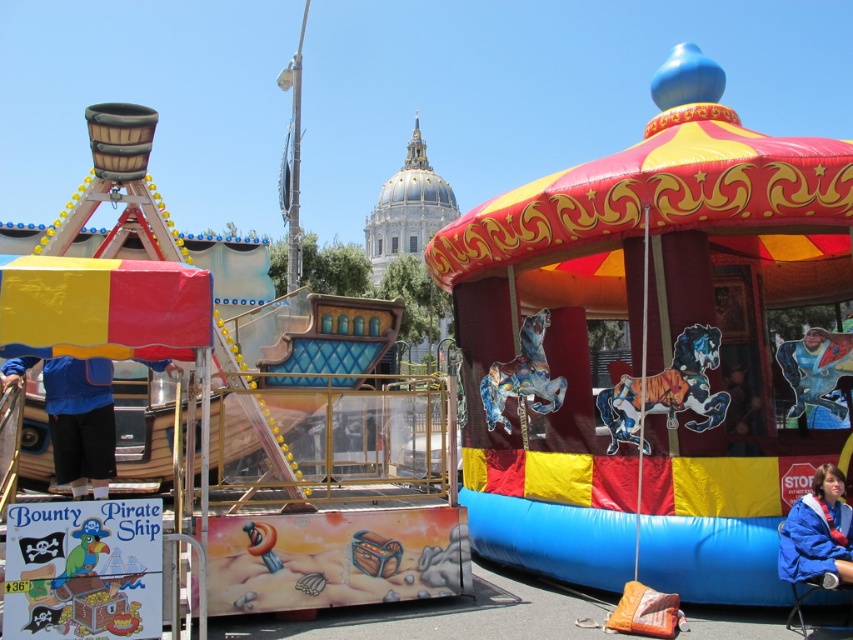
You are a carnival worker trying to organize the jackets in the image. You need to place the blue fabric jacket at left and the blue fabric jacket at lower right into separate storage bins. Which jacket is located higher up in the image?

The blue fabric jacket at left is positioned over the blue fabric jacket at lower right, so the jacket at left is higher up.

You are a parent holding a blue fabric jacket at lower right and need to pass through the entrance of the rubberized inflatable carousel at center. Can the jacket fit through the entrance without being folded?

The rubberized inflatable carousel at center is wider than the blue fabric jacket at lower right, so the jacket can fit through the entrance without needing to be folded.